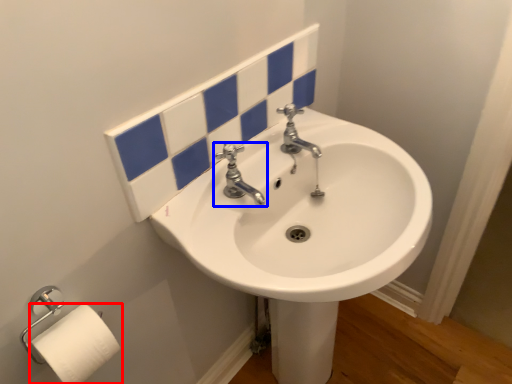
Question: Among these objects, which one is nearest to the camera, toilet paper (highlighted by a red box) or tap (highlighted by a blue box)?

Choices:
 (A) toilet paper
 (B) tap

Answer: (A)